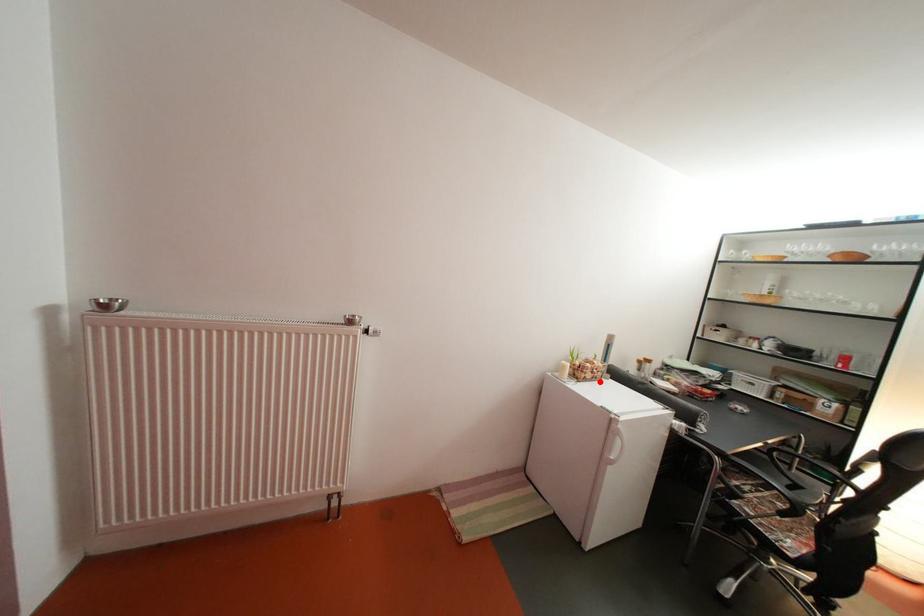
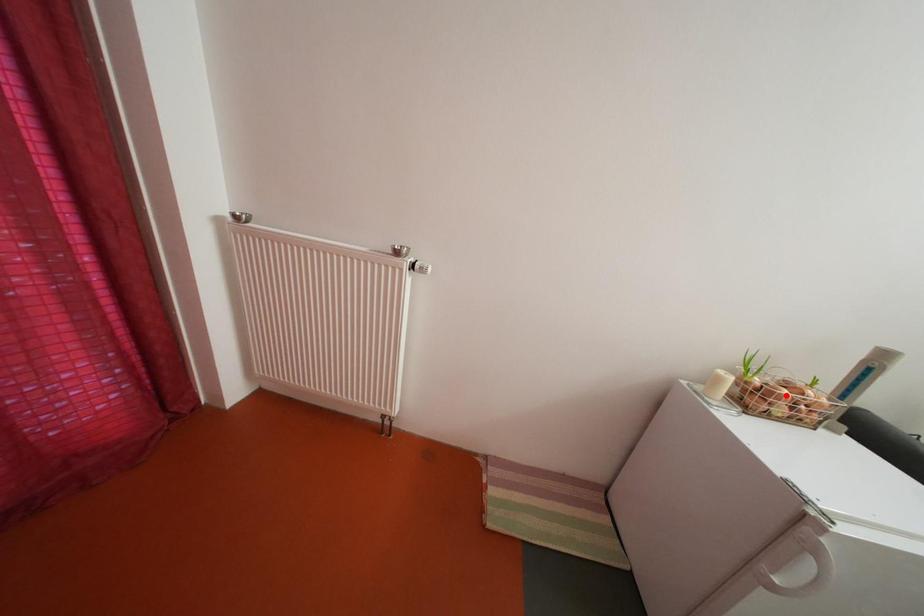
I am providing you with two images of the same scene from different viewpoints. A red point is marked on the first image and another point is marked on the second image. Does the point marked in image1 correspond to the same location as the one in image2?

No